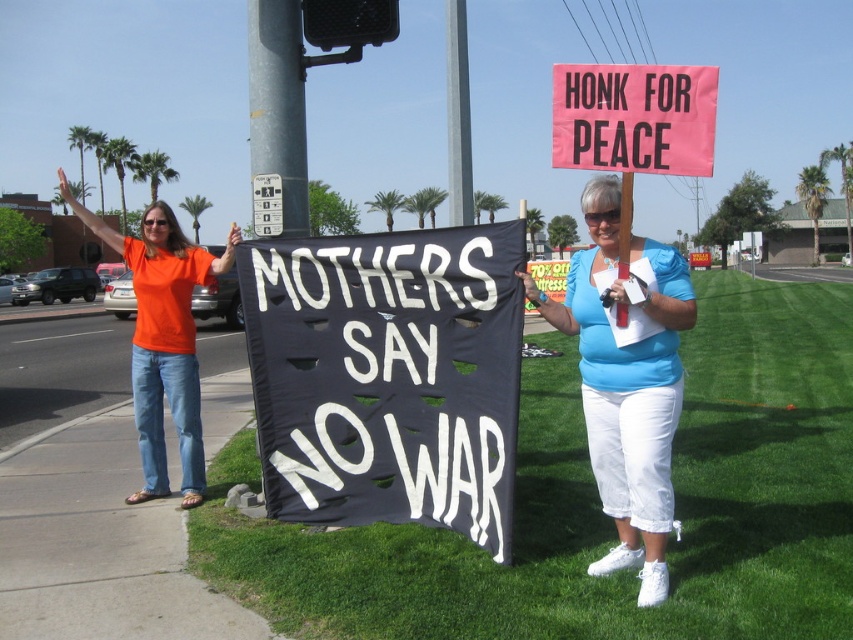
Question: Which object is the closest to the orange t-shirt at left?

Choices:
 (A) pink paper sign at upper center
 (B) metallic silver street sign at upper center
 (C) blue cotton shirt at center

Answer: (B)

Question: Is metallic gray pole at center wider than gray concrete pole at upper center?

Choices:
 (A) no
 (B) yes

Answer: (A)

Question: Among these points, which one is nearest to the camera?

Choices:
 (A) (271, 184)
 (B) (293, 88)
 (C) (163, 284)

Answer: (C)

Question: Where is blue cotton shirt at center located in relation to metallic gray pole at center in the image?

Choices:
 (A) above
 (B) below

Answer: (B)

Question: Is gray concrete pole at upper center to the left of metallic silver street sign at upper center from the viewer's perspective?

Choices:
 (A) no
 (B) yes

Answer: (A)

Question: Which object is closer to the camera taking this photo?

Choices:
 (A) gray concrete pole at upper center
 (B) pink paper sign at upper center
 (C) metallic silver street sign at upper center

Answer: (B)